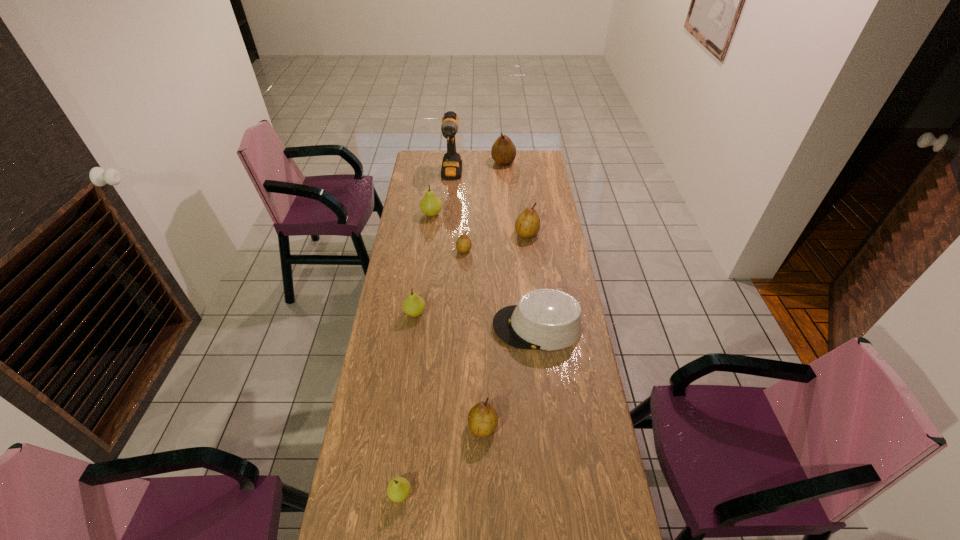
Identify which brown pear is the nearest to the second nearest pear. Please provide its 2D coordinates. Your answer should be formatted as a tuple, i.e. [(x, y)], where the tuple contains the x and y coordinates of a point satisfying the conditions above.

[(463, 244)]

Where is `the third closest green pear to the farthest brown pear`? the third closest green pear to the farthest brown pear is located at coordinates (399, 488).

Locate which green pear ranks second in proximity to the second nearest green pear. Please provide its 2D coordinates. Your answer should be formatted as a tuple, i.e. [(x, y)], where the tuple contains the x and y coordinates of a point satisfying the conditions above.

[(399, 488)]

Locate an element on the screen. This screenshot has height=540, width=960. vacant space that satisfies the following two spatial constraints: 1. on the back side of the nearest pear; 2. on the right side of the second tallest object is located at coordinates (441, 162).

This screenshot has width=960, height=540. Identify the location of free point that satisfies the following two spatial constraints: 1. on the back side of the tallest pear; 2. on the left side of the farthest green pear. (439, 162).